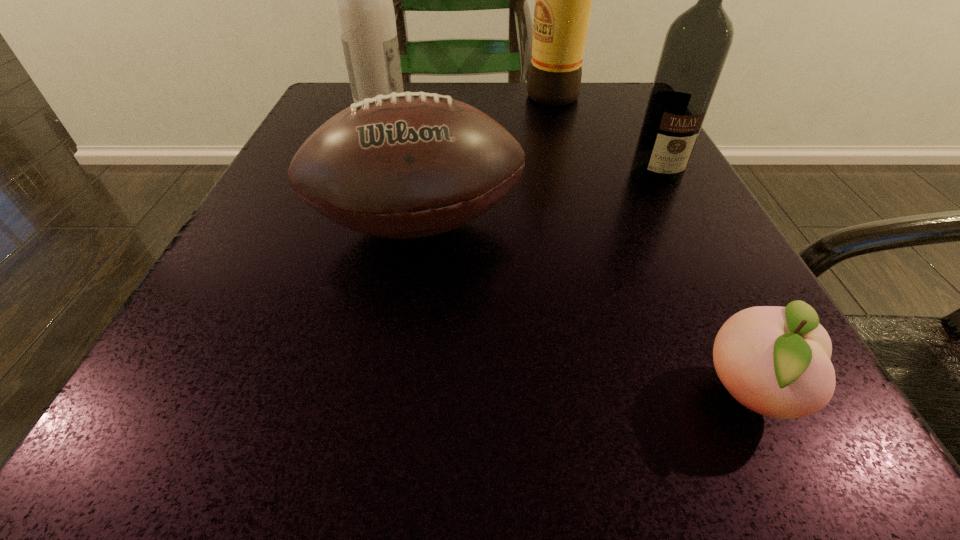
Find the location of a particular element. The height and width of the screenshot is (540, 960). vacant position in the image that satisfies the following two spatial constraints: 1. on the label of the second alcohol from right to left; 2. on the back side of the peach is located at coordinates (636, 394).